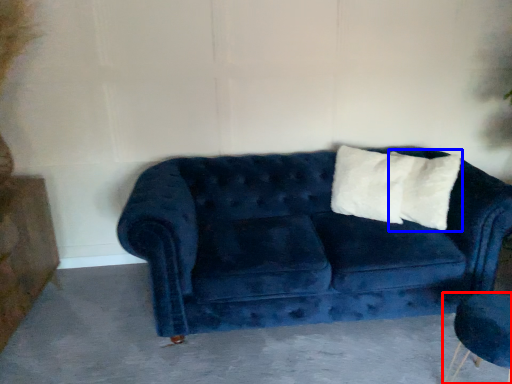
Question: Which object is closer to the camera taking this photo, armchair (highlighted by a red box) or pillow (highlighted by a blue box)?

Choices:
 (A) armchair
 (B) pillow

Answer: (A)